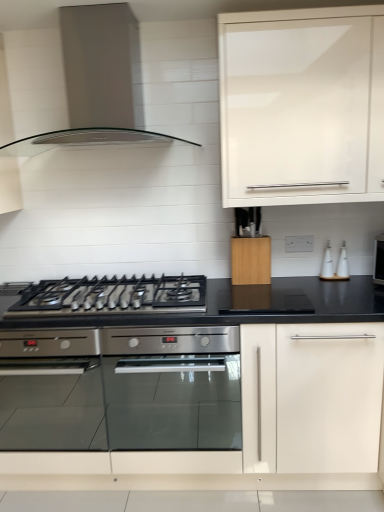
Question: Can you confirm if black matte gas stove at center is shorter than white glossy bottle at right?

Choices:
 (A) yes
 (B) no

Answer: (A)

Question: Can you confirm if black matte gas stove at center is positioned to the right of white glossy bottle at right?

Choices:
 (A) no
 (B) yes

Answer: (A)

Question: From a real-world perspective, is black matte gas stove at center located higher than white glossy bottle at right?

Choices:
 (A) no
 (B) yes

Answer: (A)

Question: Is black matte gas stove at center closer to camera compared to white glossy bottle at right?

Choices:
 (A) no
 (B) yes

Answer: (B)

Question: Considering the relative sizes of black matte gas stove at center and white glossy bottle at right in the image provided, is black matte gas stove at center wider than white glossy bottle at right?

Choices:
 (A) no
 (B) yes

Answer: (B)

Question: From a real-world perspective, is white glossy bottle at right physically located above or below white glossy soap dispenser at right?

Choices:
 (A) below
 (B) above

Answer: (B)

Question: Does point (321, 275) appear closer or farther from the camera than point (339, 261)?

Choices:
 (A) closer
 (B) farther

Answer: (B)

Question: Looking at their shapes, would you say white glossy bottle at right is wider or thinner than white glossy soap dispenser at right?

Choices:
 (A) thin
 (B) wide

Answer: (A)

Question: Is white glossy bottle at right inside or outside of white glossy soap dispenser at right?

Choices:
 (A) inside
 (B) outside

Answer: (B)

Question: In the image, is black matte gas stove at center on the left side or the right side of wooden knife block at center, placed as the 1th cabinetry when sorted from bottom to top?

Choices:
 (A) right
 (B) left

Answer: (B)

Question: From a real-world perspective, is black matte gas stove at center physically located above or below wooden knife block at center, placed as the 1th cabinetry when sorted from bottom to top?

Choices:
 (A) below
 (B) above

Answer: (A)

Question: Considering the positions of point (203, 275) and point (251, 276), is point (203, 275) closer or farther from the camera than point (251, 276)?

Choices:
 (A) closer
 (B) farther

Answer: (B)

Question: From the image's perspective, is black matte gas stove at center positioned above or below wooden knife block at center, which is the second cabinetry in top-to-bottom order?

Choices:
 (A) above
 (B) below

Answer: (B)

Question: From a real-world perspective, is white glossy bottle at right positioned above or below white glossy cabinet at upper right, the second cabinetry from the bottom?

Choices:
 (A) above
 (B) below

Answer: (B)

Question: Choose the correct answer: Is white glossy bottle at right inside white glossy cabinet at upper right, marked as the first cabinetry in a top-to-bottom arrangement, or outside it?

Choices:
 (A) inside
 (B) outside

Answer: (B)